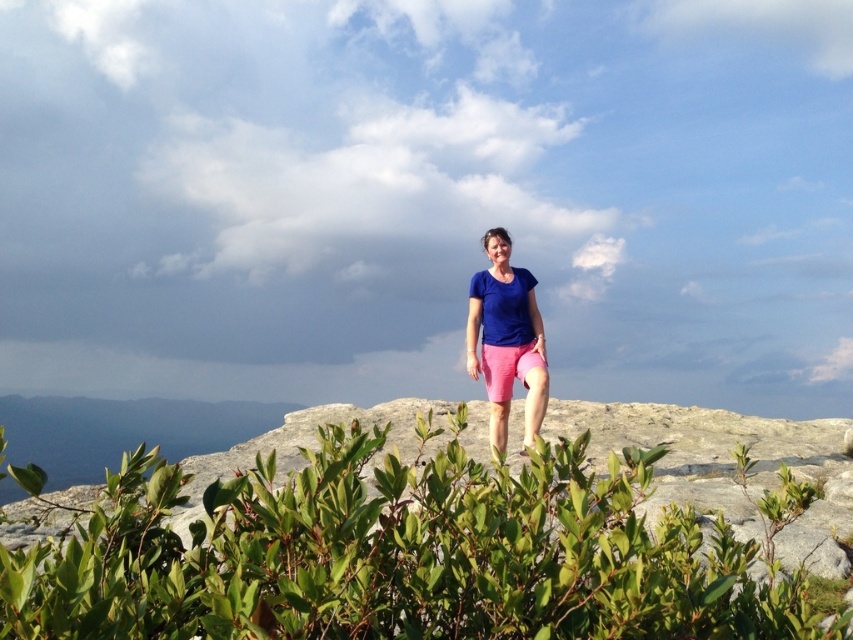
Question: Estimate the real-world distances between objects in this image. Which object is closer to the pink cotton shorts at center?

Choices:
 (A) matte blue t-shirt at center
 (B) green leafy shrub at center

Answer: (A)

Question: Does matte blue t-shirt at center have a greater width compared to pink cotton shorts at center?

Choices:
 (A) yes
 (B) no

Answer: (A)

Question: Does green leafy shrub at center have a lesser width compared to matte blue t-shirt at center?

Choices:
 (A) no
 (B) yes

Answer: (A)

Question: Does matte blue t-shirt at center have a larger size compared to pink cotton shorts at center?

Choices:
 (A) no
 (B) yes

Answer: (B)

Question: Which of the following is the closest to the observer?

Choices:
 (A) green leafy shrub at center
 (B) pink cotton shorts at center

Answer: (A)

Question: Which of these objects is positioned farthest from the pink cotton shorts at center?

Choices:
 (A) green leafy shrub at center
 (B) matte blue t-shirt at center

Answer: (A)